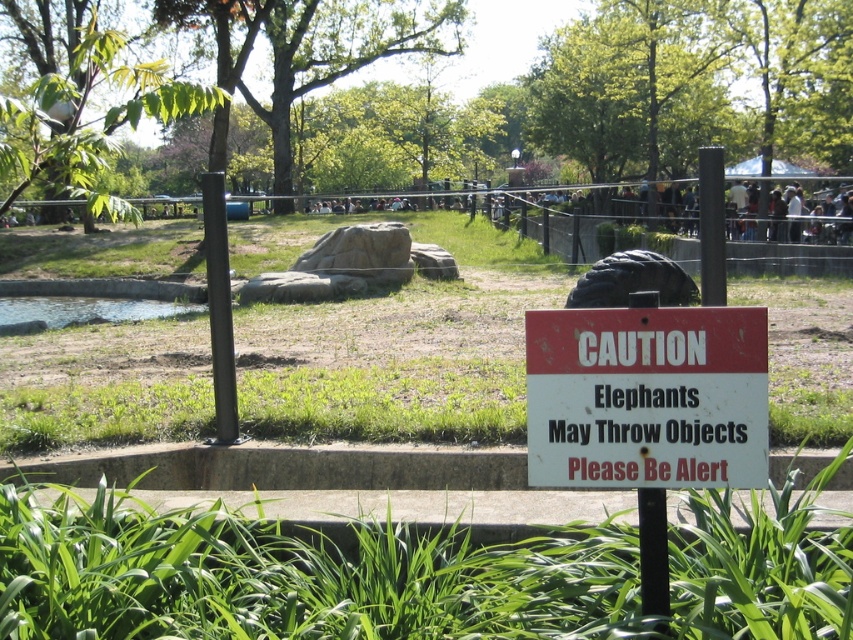
Can you confirm if white paper sign at center is bigger than black metal fence at upper center?

No, white paper sign at center is not bigger than black metal fence at upper center.

Who is higher up, white paper sign at center or black metal fence at upper center?

Positioned higher is black metal fence at upper center.

Find the location of a particular element. white paper sign at center is located at coordinates (647, 397).

Which is in front, point (851, 444) or point (601, 336)?

Point (601, 336) is in front.

Locate an element on the screen. Image resolution: width=853 pixels, height=640 pixels. green leafy grass at lower center is located at coordinates (410, 573).

Which is in front, point (573, 545) or point (645, 353)?

Positioned in front is point (645, 353).

What are the coordinates of `green leafy grass at lower center` in the screenshot? It's located at coord(410,573).

This screenshot has height=640, width=853. Describe the element at coordinates (410, 573) in the screenshot. I see `green leafy grass at lower center` at that location.

Can you confirm if green leafy grass at lower center is wider than black metal fence at upper center?

No, green leafy grass at lower center is not wider than black metal fence at upper center.

Does point (236, 552) come closer to viewer compared to point (814, 236)?

Yes, it is in front of point (814, 236).

Where is `green leafy grass at lower center`? green leafy grass at lower center is located at coordinates (410, 573).